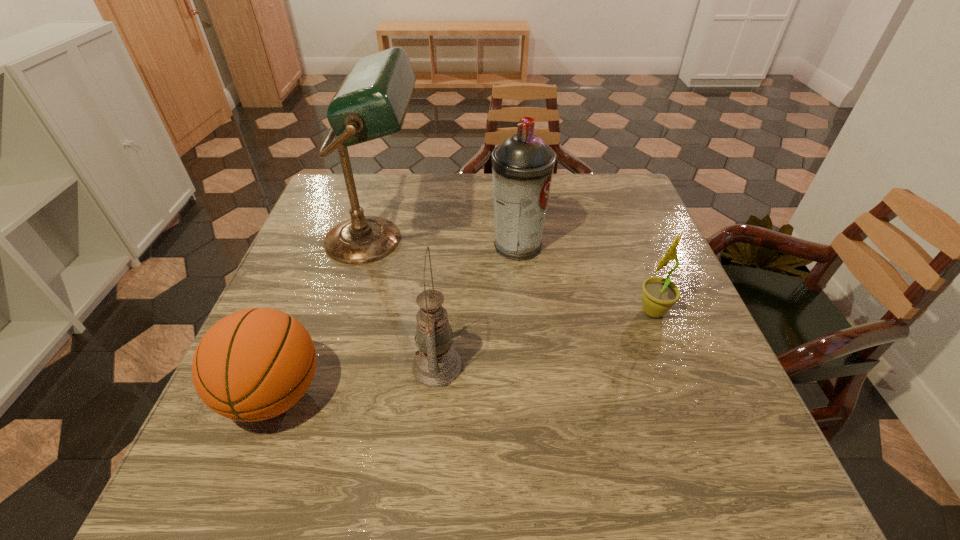
The height and width of the screenshot is (540, 960). What are the coordinates of `free location located on the face of the sunflower` in the screenshot? It's located at (493, 311).

Where is `free location located on the face of the sunflower`? free location located on the face of the sunflower is located at coordinates (535, 311).

Image resolution: width=960 pixels, height=540 pixels. I want to click on free space located on the face of the sunflower, so [570, 311].

This screenshot has height=540, width=960. What are the coordinates of `vacant space located on the back of the basketball` in the screenshot? It's located at (318, 281).

Where is `object located in the far edge section of the desktop`? The image size is (960, 540). object located in the far edge section of the desktop is located at coordinates (372, 101).

In order to click on table lamp that is at the left edge in this screenshot , I will do `click(372, 101)`.

I want to click on basketball positioned at the left edge, so click(x=254, y=364).

The image size is (960, 540). I want to click on object that is at the right edge, so click(659, 294).

Image resolution: width=960 pixels, height=540 pixels. What are the coordinates of `object located in the far left corner section of the desktop` in the screenshot? It's located at (372, 101).

Find the location of a particular element. free region at the far edge of the desktop is located at coordinates (560, 208).